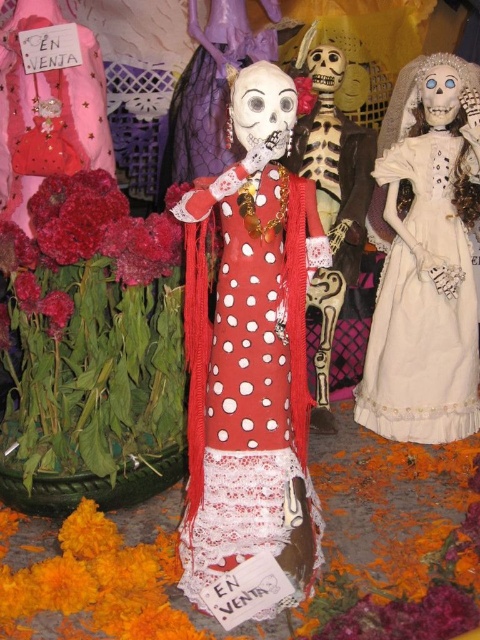
Who is shorter, white lace dress at right or matte red flower at center?

matte red flower at center is shorter.

Measure the distance between white lace dress at right and matte red flower at center.

A distance of 14.64 inches exists between white lace dress at right and matte red flower at center.

Where is `white lace dress at right`? The height and width of the screenshot is (640, 480). white lace dress at right is located at coordinates (423, 301).

Is point (256, 452) positioned after point (324, 204)?

No, (256, 452) is closer to viewer.

Can you confirm if red polka dot fabric dress at center is bigger than matte polka dot dress at center?

Actually, red polka dot fabric dress at center might be smaller than matte polka dot dress at center.

Is point (190, 497) closer to camera compared to point (360, 188)?

Yes, it is.

Where is `red polka dot fabric dress at center`? Image resolution: width=480 pixels, height=640 pixels. red polka dot fabric dress at center is located at coordinates (249, 378).

Is red polka dot fabric dress at center above matte red flower at center?

Actually, red polka dot fabric dress at center is below matte red flower at center.

Find the location of `red polka dot fabric dress at center`. red polka dot fabric dress at center is located at coordinates (249, 378).

What are the coordinates of `red polka dot fabric dress at center` in the screenshot? It's located at (249, 378).